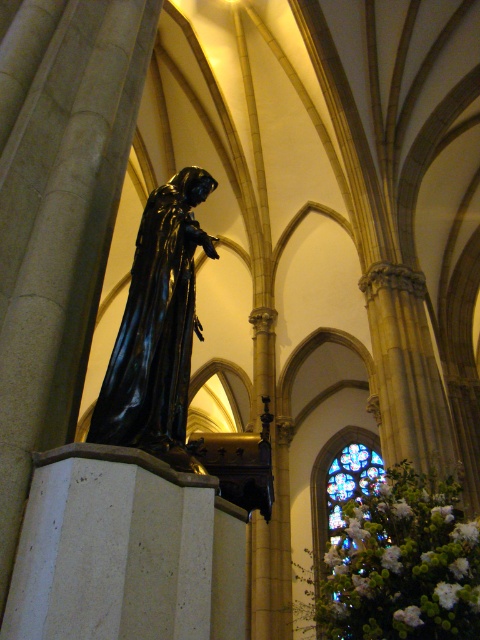
Question: Considering the relative positions of shiny black statue at center and stained glass window at center in the image provided, where is shiny black statue at center located with respect to stained glass window at center?

Choices:
 (A) above
 (B) below

Answer: (A)

Question: Is shiny black statue at center positioned behind stained glass window at center?

Choices:
 (A) no
 (B) yes

Answer: (A)

Question: Which of the following is the farthest from the observer?

Choices:
 (A) shiny black statue at center
 (B) stained glass window at center

Answer: (B)

Question: Which point is closer to the camera?

Choices:
 (A) stained glass window at center
 (B) shiny black statue at center

Answer: (B)

Question: Is shiny black statue at center wider than stained glass window at center?

Choices:
 (A) yes
 (B) no

Answer: (B)

Question: Which point is closer to the camera taking this photo?

Choices:
 (A) (348, 451)
 (B) (193, 310)

Answer: (B)